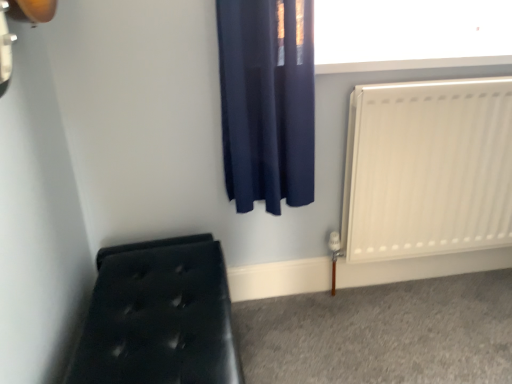
Question: Could you tell me if white smooth window sill at upper center is facing black tufted bench at lower left?

Choices:
 (A) yes
 (B) no

Answer: (B)

Question: Is black tufted bench at lower left at the back of white smooth window sill at upper center?

Choices:
 (A) no
 (B) yes

Answer: (A)

Question: Does white smooth window sill at upper center touch black tufted bench at lower left?

Choices:
 (A) no
 (B) yes

Answer: (A)

Question: Does white smooth window sill at upper center have a smaller size compared to black tufted bench at lower left?

Choices:
 (A) yes
 (B) no

Answer: (A)

Question: Is the depth of white smooth window sill at upper center less than that of black tufted bench at lower left?

Choices:
 (A) no
 (B) yes

Answer: (A)

Question: From a real-world perspective, is white smooth window sill at upper center physically above black tufted bench at lower left?

Choices:
 (A) no
 (B) yes

Answer: (B)

Question: Does white smooth window sill at upper center have a larger size compared to white matte radiator at right?

Choices:
 (A) no
 (B) yes

Answer: (A)

Question: From the image's perspective, is white smooth window sill at upper center located beneath white matte radiator at right?

Choices:
 (A) no
 (B) yes

Answer: (A)

Question: Is white smooth window sill at upper center not inside white matte radiator at right?

Choices:
 (A) no
 (B) yes

Answer: (B)

Question: Does white smooth window sill at upper center have a smaller size compared to white matte radiator at right?

Choices:
 (A) no
 (B) yes

Answer: (B)

Question: Are white smooth window sill at upper center and white matte radiator at right located far from each other?

Choices:
 (A) yes
 (B) no

Answer: (B)

Question: Is white smooth window sill at upper center in front of white matte radiator at right?

Choices:
 (A) no
 (B) yes

Answer: (A)

Question: Can you confirm if black tufted bench at lower left is taller than white matte radiator at right?

Choices:
 (A) no
 (B) yes

Answer: (A)